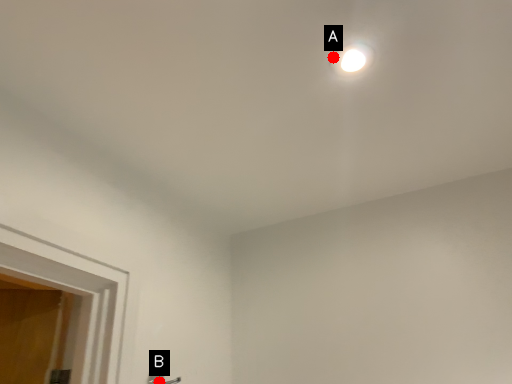
Question: Two points are circled on the image, labeled by A and B beside each circle. Which point appears closest to the camera in this image?

Choices:
 (A) A is closer
 (B) B is closer

Answer: (A)